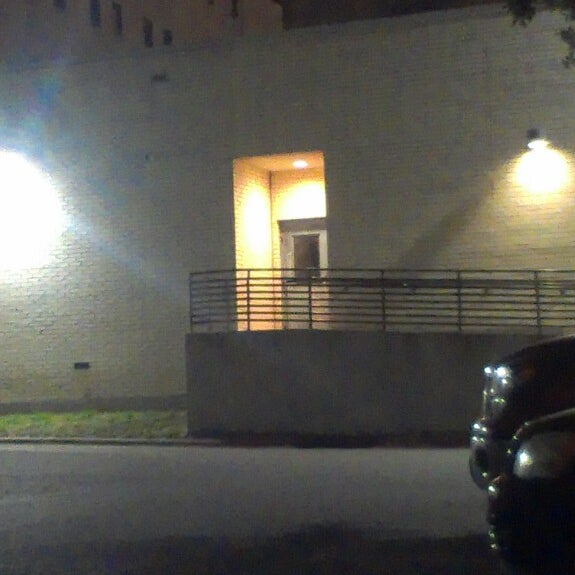
Identify the location of black metallic railing. The height and width of the screenshot is (575, 575). (240, 269).